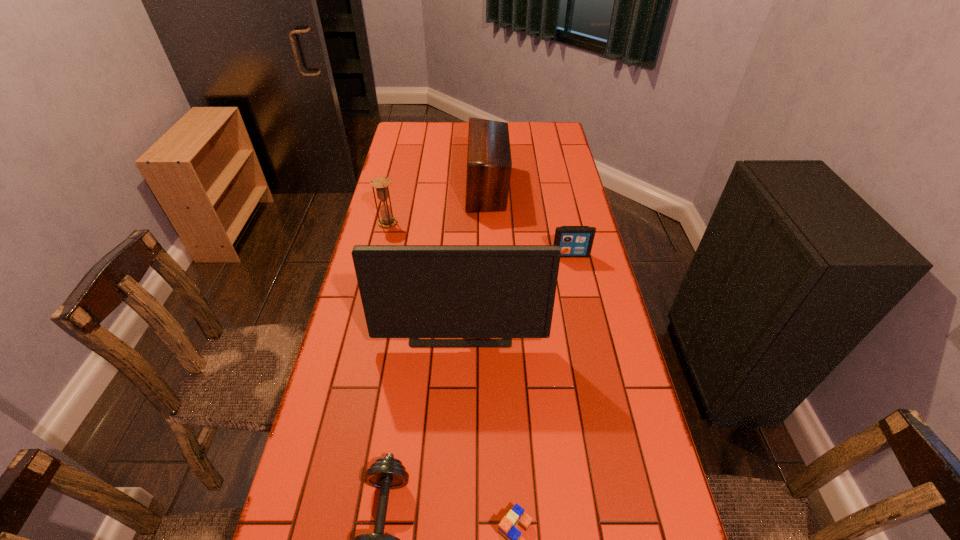
Where is `free point located on the front-facing side of the radio receiver`? Image resolution: width=960 pixels, height=540 pixels. free point located on the front-facing side of the radio receiver is located at coordinates (385, 187).

You are a GUI agent. You are given a task and a screenshot of the screen. Output one action in this format:
    pyautogui.click(x=<x>, y=<y>)
    Task: Click on the free region located on the front-facing side of the radio receiver
    Image resolution: width=960 pixels, height=540 pixels.
    Given the screenshot: What is the action you would take?
    pyautogui.click(x=415, y=187)

This screenshot has width=960, height=540. What are the coordinates of `vacant space located on the front of the leftmost object` in the screenshot? It's located at (384, 240).

The width and height of the screenshot is (960, 540). I want to click on free region located 0.390m on the front screen of the rightmost object, so click(592, 357).

Where is `computer monitor located in the left edge section of the desktop`? computer monitor located in the left edge section of the desktop is located at coordinates pos(408,291).

The height and width of the screenshot is (540, 960). What are the coordinates of `hourglass that is at the left edge` in the screenshot? It's located at (381, 184).

I want to click on object at the right edge, so click(574, 241).

The height and width of the screenshot is (540, 960). Identify the location of vacant space at the left edge of the desktop. (318, 475).

In the image, there is a desktop. Identify the location of blank space at the right edge. (562, 154).

In the image, there is a desktop. Identify the location of free space at the far left corner. (423, 140).